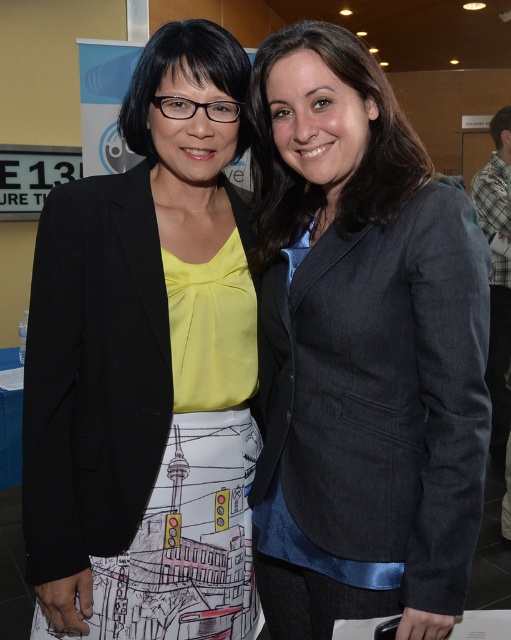
Question: Is the position of dark gray textured blazer at center more distant than that of matte black blazer at center?

Choices:
 (A) no
 (B) yes

Answer: (A)

Question: Is dark gray textured blazer at center further to camera compared to matte black blazer at center?

Choices:
 (A) no
 (B) yes

Answer: (A)

Question: Where is dark gray textured blazer at center located in relation to matte black blazer at center in the image?

Choices:
 (A) above
 (B) below

Answer: (B)

Question: Which object is farther from the camera taking this photo?

Choices:
 (A) matte black blazer at center
 (B) dark gray textured blazer at center

Answer: (A)